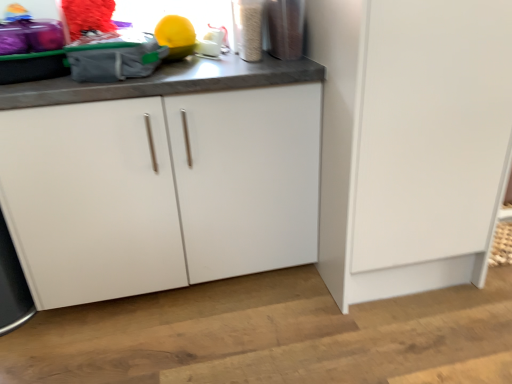
This screenshot has width=512, height=384. I want to click on free space in front of white matte cabinet door at lower right, so click(x=396, y=334).